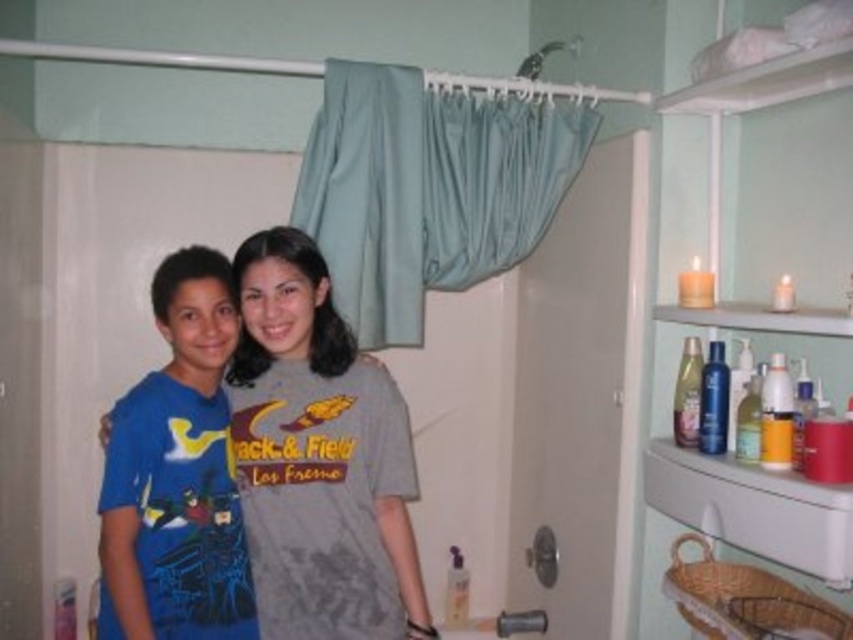
Question: Does blue cotton shirt at left appear over white plastic sink at lower right?

Choices:
 (A) yes
 (B) no

Answer: (A)

Question: Based on their relative distances, which object is nearer to the gray cotton t-shirt at center?

Choices:
 (A) white plastic sink at lower right
 (B) blue cotton shirt at left

Answer: (B)

Question: Does gray cotton t-shirt at center have a greater width compared to blue cotton shirt at left?

Choices:
 (A) yes
 (B) no

Answer: (A)

Question: Which point is farther to the camera?

Choices:
 (A) (753, 532)
 (B) (195, 456)

Answer: (B)

Question: Which point is closer to the camera?

Choices:
 (A) gray cotton t-shirt at center
 (B) blue cotton shirt at left

Answer: (B)

Question: Does gray cotton t-shirt at center have a smaller size compared to white plastic sink at lower right?

Choices:
 (A) yes
 (B) no

Answer: (B)